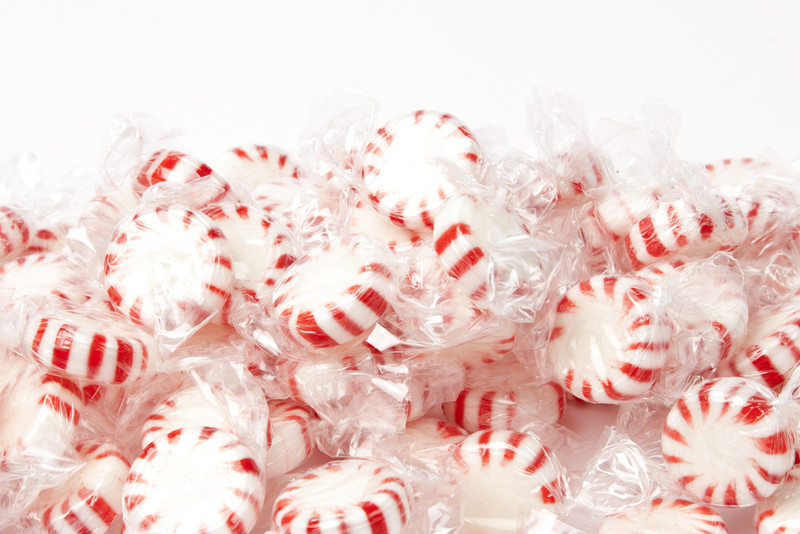
Identify the location of wall. This screenshot has height=534, width=800. (738, 49).